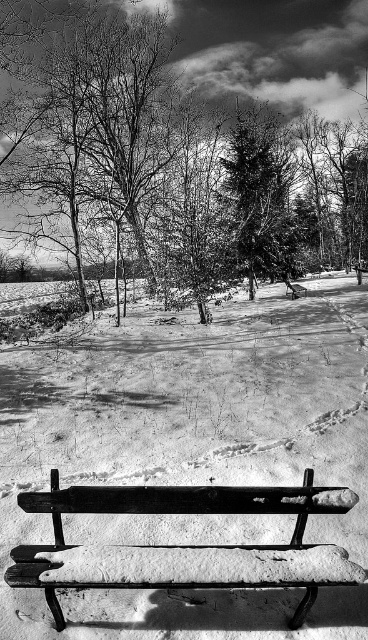
Does wooden bench at lower center have a greater height compared to smooth bark tree at center?

No.

Which is more to the right, wooden bench at lower center or smooth bark tree at center?

smooth bark tree at center is more to the right.

Between point (209, 508) and point (242, 20), which one is positioned in front?

Point (209, 508) is in front.

Find the location of `wooden bench at lower center`. wooden bench at lower center is located at coordinates (185, 545).

Based on the photo, who is lower down, wooden bench at lower center or snow-covered evergreen tree at center?

wooden bench at lower center is lower down.

Who is more distant from viewer, (327,580) or (248,170)?

The point (248,170) is behind.

Locate an element on the screen. wooden bench at lower center is located at coordinates (185, 545).

Who is positioned more to the left, smooth bark tree at center or snow-covered evergreen tree at center?

smooth bark tree at center

The width and height of the screenshot is (368, 640). I want to click on smooth bark tree at center, so click(x=270, y=51).

You are a GUI agent. You are given a task and a screenshot of the screen. Output one action in this format:
    pyautogui.click(x=<x>, y=<y>)
    Task: Click on the smooth bark tree at center
    
    Given the screenshot: What is the action you would take?
    pyautogui.click(x=270, y=51)